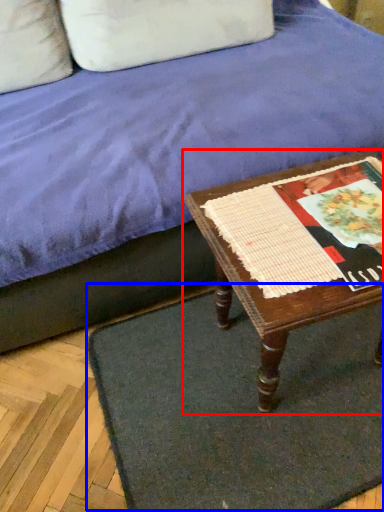
Question: Among these objects, which one is farthest to the camera, table (highlighted by a red box) or doormat (highlighted by a blue box)?

Choices:
 (A) table
 (B) doormat

Answer: (B)